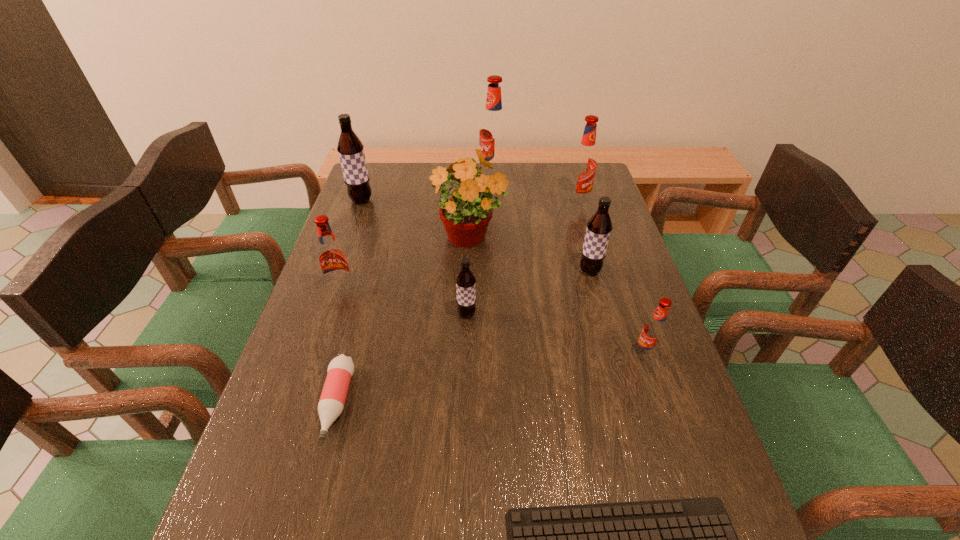
Identify the location of the second brown root beer from left to right. The width and height of the screenshot is (960, 540). (465, 281).

Where is `the sixth farthest root beer`? Image resolution: width=960 pixels, height=540 pixels. the sixth farthest root beer is located at coordinates (465, 281).

What are the coordinates of `the nearest root beer` in the screenshot? It's located at (654, 330).

In order to click on the nearest red root beer in this screenshot , I will do click(x=654, y=330).

Where is `the second nearest object`? the second nearest object is located at coordinates (340, 370).

Identify the location of the third object from left to right. The image size is (960, 540). (340, 370).

Find the location of a particular element. The width and height of the screenshot is (960, 540). vacant space positioned 0.260m on the right of the biggest red root beer is located at coordinates (576, 177).

Where is `free location located on the back of the leftmost brown root beer`? This screenshot has width=960, height=540. free location located on the back of the leftmost brown root beer is located at coordinates (367, 186).

Where is `vacant space located 0.370m on the front of the third smallest red root beer`? vacant space located 0.370m on the front of the third smallest red root beer is located at coordinates (602, 285).

Image resolution: width=960 pixels, height=540 pixels. I want to click on vacant region located on the back of the red flowerpot, so click(x=471, y=188).